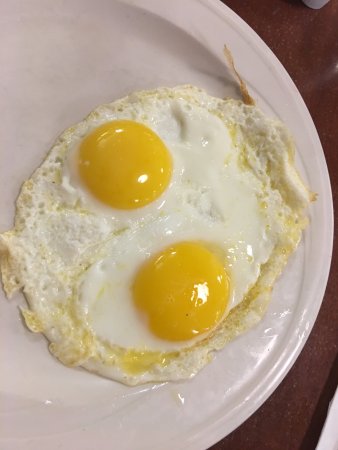
The width and height of the screenshot is (338, 450). What are the coordinates of `shine from light on plate` in the screenshot? It's located at [265, 348], [287, 365].